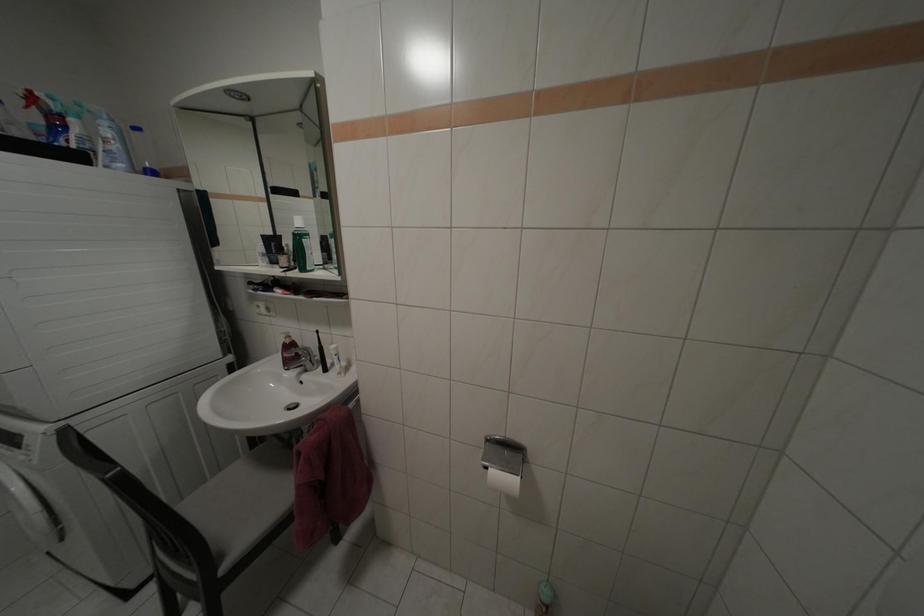
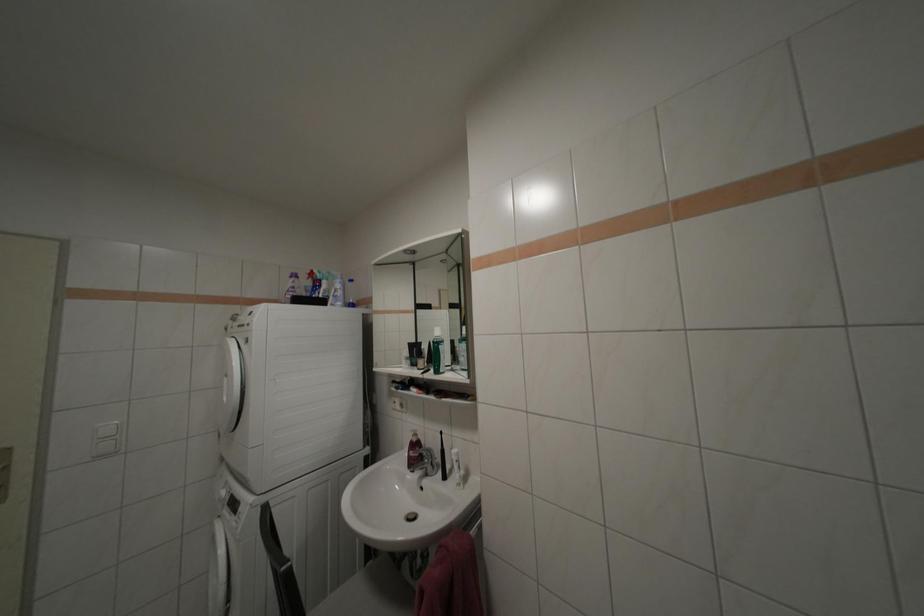
How did the camera likely rotate?

The camera rotated toward left-up.